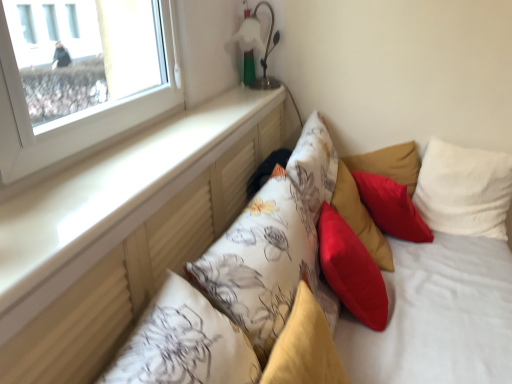
At what (x,y) coordinates should I click in order to perform the action: click on free region under metallic silver table lamp at upper center (from a real-world perspective). Please return your answer as a coordinate pair (x, y). Image resolution: width=512 pixels, height=384 pixels. Looking at the image, I should click on (256, 85).